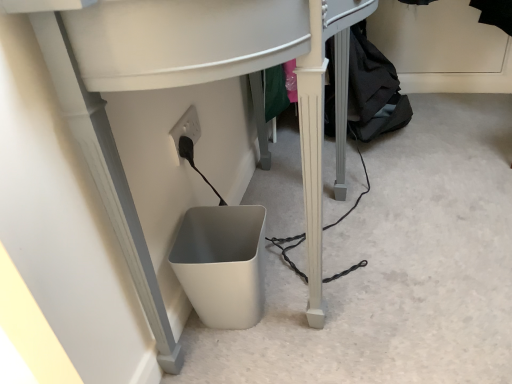
Question: In which direction should I rotate to look at white plastic computer desk at lower center?

Choices:
 (A) right
 (B) left

Answer: (A)

Question: Does black fabric at lower right have a larger size compared to white plastic computer desk at lower center?

Choices:
 (A) no
 (B) yes

Answer: (A)

Question: Considering the relative sizes of black fabric at lower right and white plastic computer desk at lower center in the image provided, is black fabric at lower right smaller than white plastic computer desk at lower center?

Choices:
 (A) no
 (B) yes

Answer: (B)

Question: From a real-world perspective, does black fabric at lower right stand above white plastic computer desk at lower center?

Choices:
 (A) yes
 (B) no

Answer: (B)

Question: From a real-world perspective, is black fabric at lower right physically below white plastic computer desk at lower center?

Choices:
 (A) no
 (B) yes

Answer: (B)

Question: Does black fabric at lower right come behind white plastic computer desk at lower center?

Choices:
 (A) no
 (B) yes

Answer: (B)

Question: Is black fabric at lower right closer to the viewer compared to white plastic computer desk at lower center?

Choices:
 (A) no
 (B) yes

Answer: (A)

Question: Considering the relative positions of white plastic computer desk at lower center and black fabric at lower right in the image provided, is white plastic computer desk at lower center in front of black fabric at lower right?

Choices:
 (A) yes
 (B) no

Answer: (A)

Question: Is white plastic computer desk at lower center positioned beyond the bounds of black fabric at lower right?

Choices:
 (A) yes
 (B) no

Answer: (A)

Question: Does white plastic computer desk at lower center have a greater width compared to black fabric at lower right?

Choices:
 (A) no
 (B) yes

Answer: (A)

Question: Would you say white plastic computer desk at lower center is a long distance from black fabric at lower right?

Choices:
 (A) no
 (B) yes

Answer: (A)

Question: Considering the relative sizes of white plastic computer desk at lower center and black fabric at lower right in the image provided, is white plastic computer desk at lower center thinner than black fabric at lower right?

Choices:
 (A) no
 (B) yes

Answer: (B)

Question: Is white plastic computer desk at lower center facing towards black fabric at lower right?

Choices:
 (A) yes
 (B) no

Answer: (B)

Question: Is white matte waste container at lower center not close to black fabric at lower right?

Choices:
 (A) no
 (B) yes

Answer: (A)